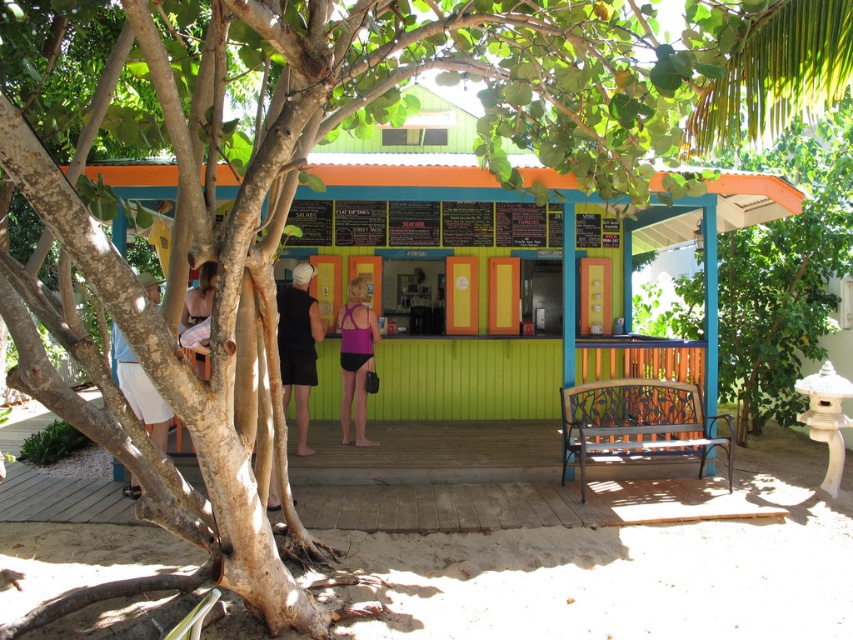
Question: Which point appears closest to the camera in this image?

Choices:
 (A) (347, 348)
 (B) (132, 403)

Answer: (B)

Question: Is pink matte swimsuit at center thinner than white fabric skirt at lower left?

Choices:
 (A) no
 (B) yes

Answer: (B)

Question: Can you confirm if black sleeveless shirt at center is smaller than white fabric skirt at lower left?

Choices:
 (A) yes
 (B) no

Answer: (A)

Question: Which point is closer to the camera?

Choices:
 (A) white fabric skirt at lower left
 (B) black sleeveless shirt at center
 (C) pink matte swimsuit at center

Answer: (A)

Question: Is black sleeveless shirt at center above white fabric skirt at lower left?

Choices:
 (A) yes
 (B) no

Answer: (A)

Question: Based on their relative distances, which object is farther from the pink matte swimsuit at center?

Choices:
 (A) white fabric skirt at lower left
 (B) black sleeveless shirt at center

Answer: (A)